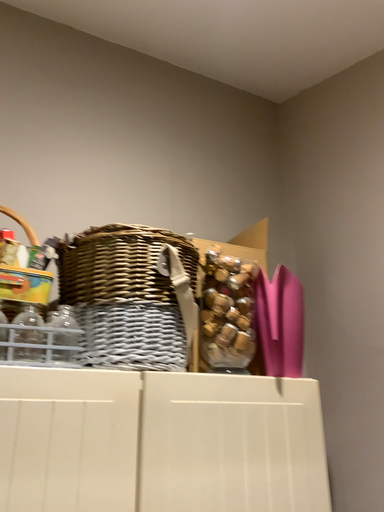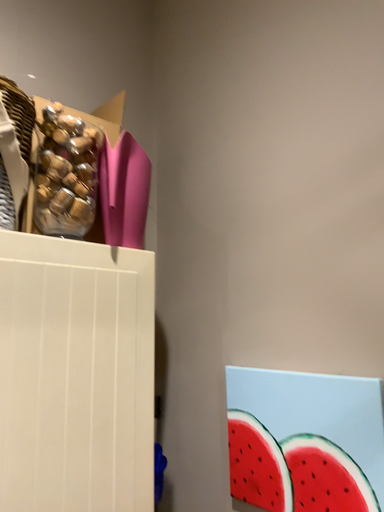
Question: How did the camera likely rotate when shooting the video?

Choices:
 (A) rotated upward
 (B) rotated downward

Answer: (B)